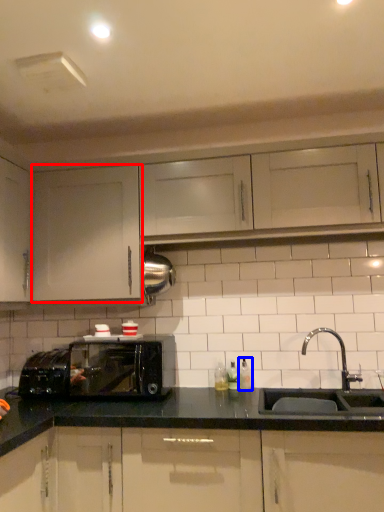
Question: Which of the following is the farthest to the observer, cabinetry (highlighted by a red box) or bottle (highlighted by a blue box)?

Choices:
 (A) cabinetry
 (B) bottle

Answer: (B)